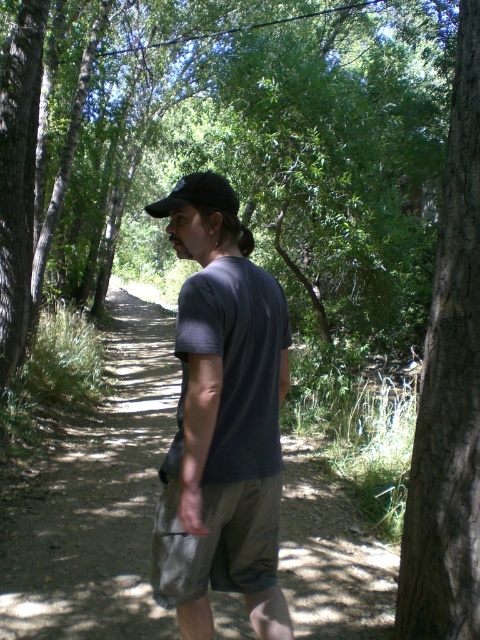
Question: Does brown rough bark tree at right appear on the right side of black matte baseball cap at center?

Choices:
 (A) no
 (B) yes

Answer: (B)

Question: Which point is farther from the camera taking this photo?

Choices:
 (A) (284, 301)
 (B) (419, 563)
 (C) (164, 403)

Answer: (C)

Question: Can you confirm if dark gray t-shirt at center is positioned to the left of brown rough bark tree at right?

Choices:
 (A) no
 (B) yes

Answer: (B)

Question: Estimate the real-world distances between objects in this image. Which object is closer to the black matte baseball cap at center?

Choices:
 (A) brown rough bark tree at right
 (B) dark gray t-shirt at center

Answer: (B)

Question: Does dirt path at center appear on the left side of dark gray t-shirt at center?

Choices:
 (A) no
 (B) yes

Answer: (B)

Question: Among these objects, which one is nearest to the camera?

Choices:
 (A) dirt path at center
 (B) brown rough bark tree at right

Answer: (B)